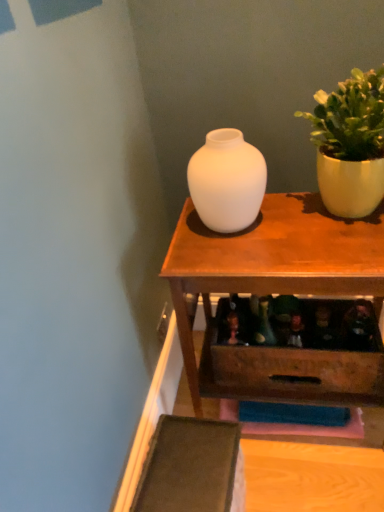
At what (x,y) coordinates should I click in order to perform the action: click on free spot in front of white matte vase at center. Please return your answer as a coordinate pair (x, y). Looking at the image, I should click on (246, 258).